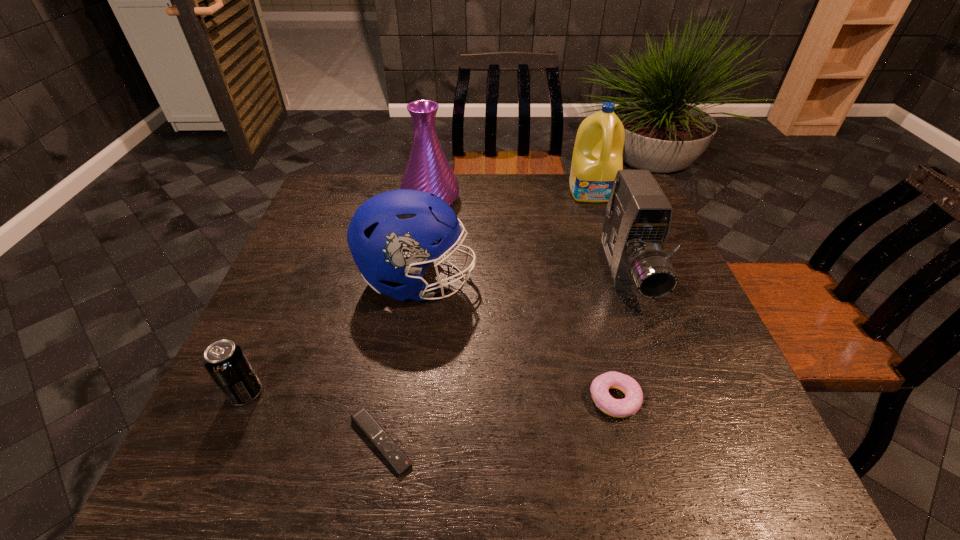
Identify the location of blank region between the vase and the soda can. The image size is (960, 540). (338, 296).

Where is `vacant region between the shortest object and the sixth tallest object`? Image resolution: width=960 pixels, height=540 pixels. vacant region between the shortest object and the sixth tallest object is located at coordinates (498, 420).

At what (x,y) coordinates should I click in order to perform the action: click on vacant space that's between the detergent and the vase. Please return your answer as a coordinate pair (x, y). The image size is (960, 540). Looking at the image, I should click on (512, 195).

Where is `object that stands as the closest to the fifth tallest object`? The width and height of the screenshot is (960, 540). object that stands as the closest to the fifth tallest object is located at coordinates (393, 454).

Select which object appears as the closest to the leftmost object. Please provide its 2D coordinates. Your answer should be formatted as a tuple, i.e. [(x, y)], where the tuple contains the x and y coordinates of a point satisfying the conditions above.

[(393, 454)]

Find the location of a particular element. The width and height of the screenshot is (960, 540). blank area in the image that satisfies the following two spatial constraints: 1. on the label of the detergent; 2. on the face guard of the football helmet is located at coordinates (624, 281).

Where is `free location that satisfies the following two spatial constraints: 1. on the label of the detergent; 2. on the face guard of the football helmet`? This screenshot has height=540, width=960. free location that satisfies the following two spatial constraints: 1. on the label of the detergent; 2. on the face guard of the football helmet is located at coordinates (624, 281).

Find the location of `vacant point that satisfies the following two spatial constraints: 1. on the face guard of the sixth tallest object; 2. on the left side of the football helmet`. vacant point that satisfies the following two spatial constraints: 1. on the face guard of the sixth tallest object; 2. on the left side of the football helmet is located at coordinates (400, 399).

Where is `free region that satisfies the following two spatial constraints: 1. at the front of the camcorder, highlighting the lens; 2. on the face guard of the football helmet`? Image resolution: width=960 pixels, height=540 pixels. free region that satisfies the following two spatial constraints: 1. at the front of the camcorder, highlighting the lens; 2. on the face guard of the football helmet is located at coordinates (629, 281).